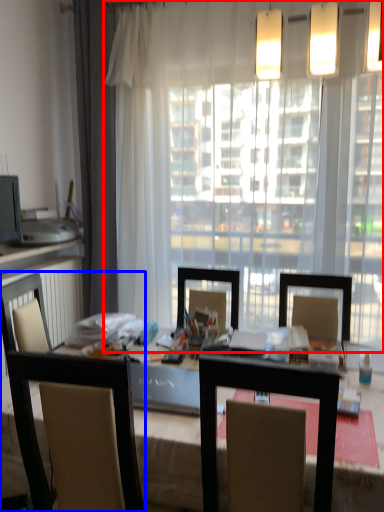
Question: Which point is closer to the camera, window (highlighted by a red box) or chair (highlighted by a blue box)?

Choices:
 (A) window
 (B) chair

Answer: (B)